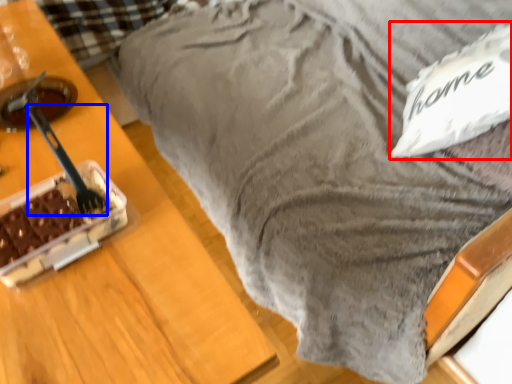
Question: Among these objects, which one is nearest to the camera, pillow (highlighted by a red box) or utensil (highlighted by a blue box)?

Choices:
 (A) pillow
 (B) utensil

Answer: (B)